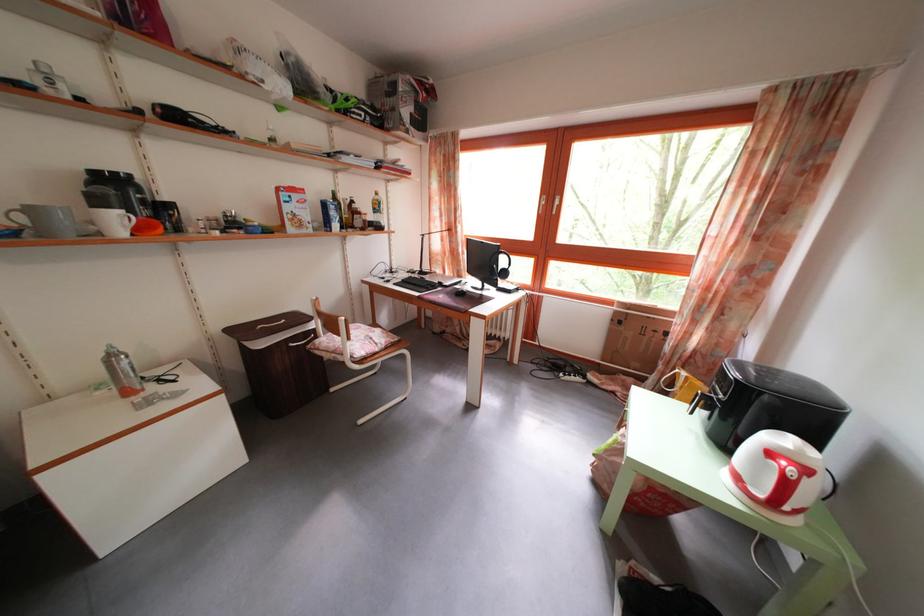
This screenshot has height=616, width=924. What do you see at coordinates (812, 490) in the screenshot?
I see `a red kettle switch` at bounding box center [812, 490].